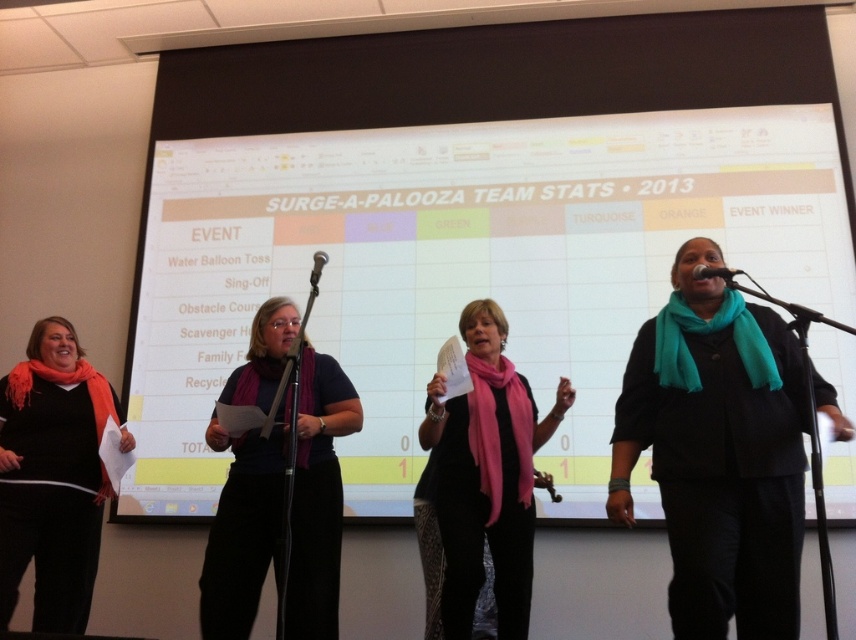
Between white paper at center and teal scarf at center, which one is positioned higher?

white paper at center is higher up.

Can you confirm if white paper at center is positioned to the right of teal scarf at center?

Incorrect, white paper at center is not on the right side of teal scarf at center.

Which is in front, point (608, 182) or point (611, 513)?

Positioned in front is point (611, 513).

Where is `white paper at center`? white paper at center is located at coordinates click(461, 268).

Between white paper at center and purple scarf at center, which one is positioned higher?

Positioned higher is white paper at center.

Can you confirm if white paper at center is positioned above purple scarf at center?

Yes, white paper at center is above purple scarf at center.

Which is in front, point (251, 148) or point (241, 604)?

Point (241, 604) is in front.

I want to click on white paper at center, so click(461, 268).

Does point (800, 509) come closer to viewer compared to point (711, 273)?

Yes.

What are the coordinates of `teal scarf at center` in the screenshot? It's located at (718, 452).

Is point (794, 614) positioned behind point (728, 275)?

No.

This screenshot has height=640, width=856. I want to click on teal scarf at center, so click(718, 452).